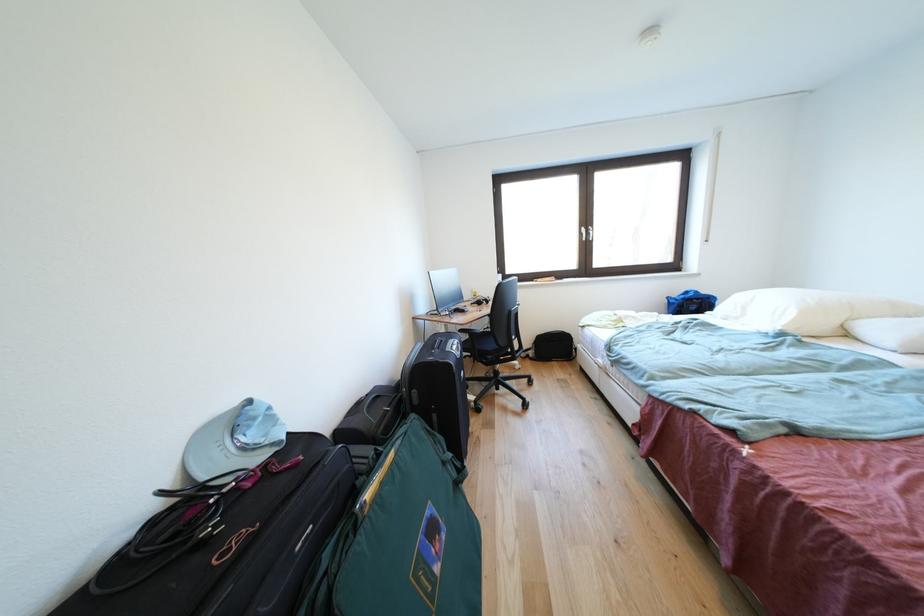
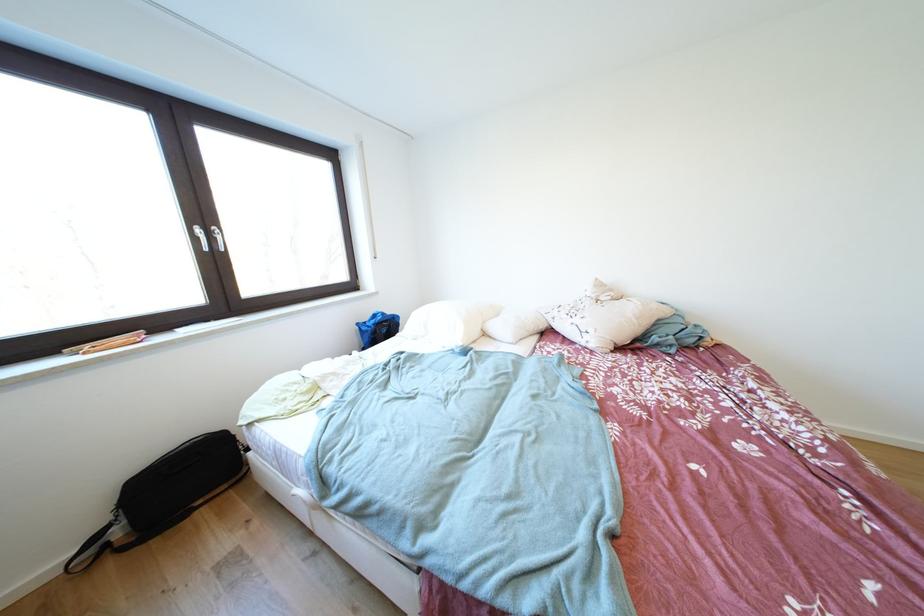
Find the pixel in the second image that matches [589,238] in the first image.

(203, 244)